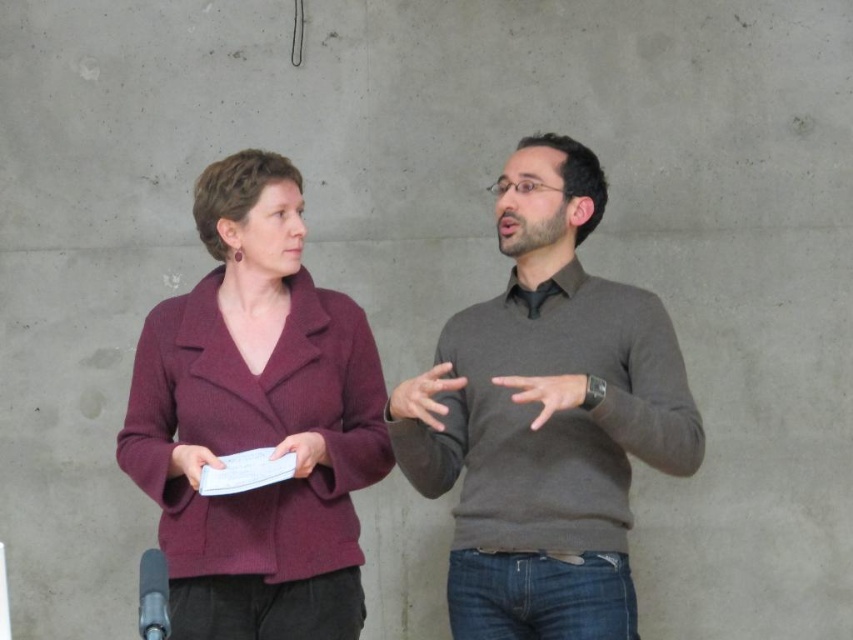
You are a photographer taking a picture of two people standing against a wall. You notice two specific points marked at coordinates point (235, 371) and point (178, 468). Which point is closer to the camera?

Point (235, 371) is further to the camera than point (178, 468), so the point closer to the camera is point (178, 468).

You are a photographer trying to capture a candid shot of the person whose hand is at the point indicated by coordinates point (544, 392). Based on the scene description, which individual should you focus on?

The point (544, 392) indicates matte gray hand at center, so you should focus on the man on the right since he is described as gesturing outwardly with his hands, which matches the location of the hand at the specified coordinates.

You are a photographer trying to capture a closeup of both hands in the image. The camera you are using has a maximum focus range of 5 inches. Based on the scene, will both the smooth brown hand at center and the matte gray hand at center fit within the camera focus range?

The smooth brown hand at center is 5.27 inches from the matte gray hand at center. Since the distance between them exceeds the camera focus range of 5 inches, the hands cannot both be in focus at the same time.